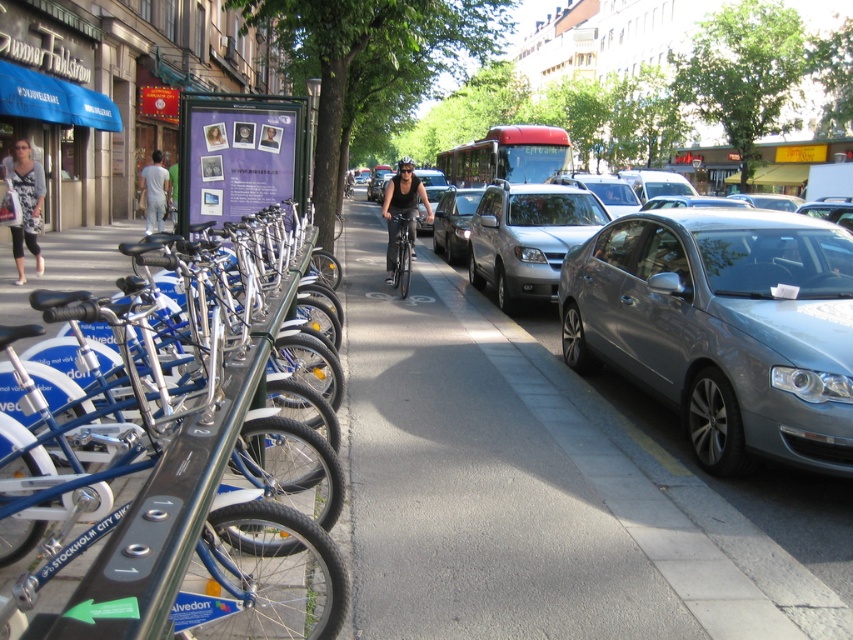
Question: Considering the relative positions of gray asphalt pavement at center and satin silver sedan at right in the image provided, where is gray asphalt pavement at center located with respect to satin silver sedan at right?

Choices:
 (A) left
 (B) right

Answer: (A)

Question: Is satin silver sedan at right to the right of matte black bicycle at center from the viewer's perspective?

Choices:
 (A) yes
 (B) no

Answer: (A)

Question: Which point is closer to the camera taking this photo?

Choices:
 (A) (450, 248)
 (B) (122, 509)
 (C) (566, 369)
 (D) (485, 276)

Answer: (B)

Question: Which object appears farthest from the camera in this image?

Choices:
 (A) blue metallic bicycle at left
 (B) satin silver sedan at right

Answer: (B)

Question: Which point appears closest to the camera in this image?

Choices:
 (A) (473, 196)
 (B) (694, 227)
 (C) (405, 236)
 (D) (575, 397)

Answer: (B)

Question: Can you confirm if silver metallic sedan at center is wider than shiny silver sedan at center?

Choices:
 (A) yes
 (B) no

Answer: (A)